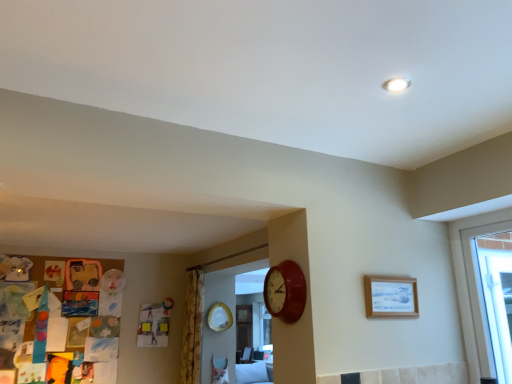
Question: Looking at the image, does wooden picture frame at upper right seem bigger or smaller compared to yellow floral fabric curtain at center?

Choices:
 (A) small
 (B) big

Answer: (A)

Question: From the image's perspective, is wooden picture frame at upper right positioned above or below yellow floral fabric curtain at center?

Choices:
 (A) below
 (B) above

Answer: (B)

Question: Which object is positioned closest to the matte red clock at center?

Choices:
 (A) wooden picture frame at upper right
 (B) yellow floral fabric curtain at center

Answer: (A)

Question: Which is farther from the yellow floral fabric curtain at center?

Choices:
 (A) matte red clock at center
 (B) wooden picture frame at upper right

Answer: (B)